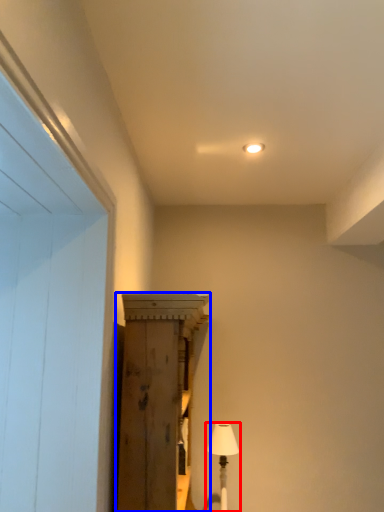
Question: Among these objects, which one is farthest to the camera, table lamp (highlighted by a red box) or cabinetry (highlighted by a blue box)?

Choices:
 (A) table lamp
 (B) cabinetry

Answer: (A)